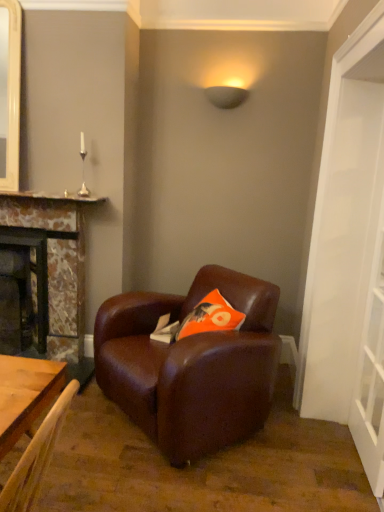
Image resolution: width=384 pixels, height=512 pixels. What do you see at coordinates (36, 269) in the screenshot?
I see `matte stone fireplace at left, which appears as the first fireplace when viewed from the left` at bounding box center [36, 269].

What do you see at coordinates (211, 317) in the screenshot? Image resolution: width=384 pixels, height=512 pixels. I see `orange fabric pillow at center` at bounding box center [211, 317].

Measure the distance between marble fireplace at left, which is the 1th fireplace from right to left, and camera.

The depth of marble fireplace at left, which is the 1th fireplace from right to left, is 9.12 feet.

Describe the element at coordinates (371, 381) in the screenshot. I see `transparent glass door at right` at that location.

You are a GUI agent. You are given a task and a screenshot of the screen. Output one action in this format:
    pyautogui.click(x=<x>, y=<y>)
    Task: Click on the matte black lampshade at upper center
    
    Given the screenshot: What is the action you would take?
    pyautogui.click(x=226, y=96)

In order to face matte black lampshade at upper center, should I rotate leftwards or rightwards?

To align with it, rotate right about 4.599°.

The width and height of the screenshot is (384, 512). I want to click on white glossy door at right, so click(341, 249).

Can we say white glossy door at right lies outside transparent glass door at right?

white glossy door at right lies outside transparent glass door at right's area.

In order to click on door in front of the transparent glass door at right in this screenshot , I will do (x=341, y=249).

What's the angular difference between white glossy door at right and transparent glass door at right's facing directions?

The angular difference between white glossy door at right and transparent glass door at right is 0.404 degrees.

Looking at this image, is brown leather armchair at center taller than white glossy door at right?

In fact, brown leather armchair at center may be shorter than white glossy door at right.

From a real-world perspective, which object stands above the other?

From a 3D spatial view, white glossy door at right is above.

Is brown leather armchair at center not near white glossy door at right?

They are positioned close to each other.

Looking at their sizes, would you say brown leather armchair at center is wider or thinner than white glossy door at right?

Considering their sizes, brown leather armchair at center looks broader than white glossy door at right.

Considering the relative sizes of matte stone fireplace at left, acting as the 2th fireplace starting from the right, and brown leather armchair at center in the image provided, is matte stone fireplace at left, acting as the 2th fireplace starting from the right, thinner than brown leather armchair at center?

Yes, matte stone fireplace at left, acting as the 2th fireplace starting from the right, is thinner than brown leather armchair at center.

How different are the orientations of matte stone fireplace at left, acting as the 2th fireplace starting from the right, and brown leather armchair at center in degrees?

The facing directions of matte stone fireplace at left, acting as the 2th fireplace starting from the right, and brown leather armchair at center are 44.9 degrees apart.

From a real-world perspective, who is located higher, matte stone fireplace at left, acting as the 2th fireplace starting from the right, or brown leather armchair at center?

In real-world perspective, matte stone fireplace at left, acting as the 2th fireplace starting from the right, is above.

Is matte stone fireplace at left, acting as the 2th fireplace starting from the right, facing away from brown leather armchair at center?

No, brown leather armchair at center is not at the back of matte stone fireplace at left, acting as the 2th fireplace starting from the right.

Considering the relative sizes of white glossy door at right and matte black lampshade at upper center in the image provided, is white glossy door at right taller than matte black lampshade at upper center?

Indeed, white glossy door at right has a greater height compared to matte black lampshade at upper center.

How distant is white glossy door at right from matte black lampshade at upper center?

white glossy door at right is 1.28 meters away from matte black lampshade at upper center.

Is white glossy door at right thinner than matte black lampshade at upper center?

No.

Is white glossy door at right in front of or behind matte black lampshade at upper center in the image?

Clearly, white glossy door at right is in front of matte black lampshade at upper center.

From a real-world perspective, who is located higher, white glossy door at right or brown leather armchair at center?

In real-world perspective, white glossy door at right is above.

Can you confirm if white glossy door at right is shorter than brown leather armchair at center?

A: Incorrect, the height of white glossy door at right does not fall short of that of brown leather armchair at center.

Is white glossy door at right placed right next to brown leather armchair at center?

No, white glossy door at right is not with brown leather armchair at center.

From the image's perspective, does white glossy door at right appear higher than brown leather armchair at center?

Indeed, from the image's perspective, white glossy door at right is shown above brown leather armchair at center.

Considering the relative sizes of matte stone fireplace at left, acting as the 2th fireplace starting from the right, and white glossy door at right in the image provided, is matte stone fireplace at left, acting as the 2th fireplace starting from the right, smaller than white glossy door at right?

Yes, matte stone fireplace at left, acting as the 2th fireplace starting from the right, is smaller than white glossy door at right.

Are matte stone fireplace at left, which appears as the first fireplace when viewed from the left, and white glossy door at right making contact?

No, matte stone fireplace at left, which appears as the first fireplace when viewed from the left, is not making contact with white glossy door at right.

Which object is wider, matte stone fireplace at left, acting as the 2th fireplace starting from the right, or white glossy door at right?

With larger width is white glossy door at right.

Considering the relative positions of matte stone fireplace at left, acting as the 2th fireplace starting from the right, and white glossy door at right in the image provided, is matte stone fireplace at left, acting as the 2th fireplace starting from the right, to the left of white glossy door at right from the viewer's perspective?

Indeed, matte stone fireplace at left, acting as the 2th fireplace starting from the right, is positioned on the left side of white glossy door at right.

Looking at this image, which of these two, marble fireplace at left, the 2th fireplace in the left-to-right sequence, or orange fabric pillow at center, is smaller?

Smaller between the two is orange fabric pillow at center.

From the image's perspective, is marble fireplace at left, the 2th fireplace in the left-to-right sequence, under orange fabric pillow at center?

No, from the image's perspective, marble fireplace at left, the 2th fireplace in the left-to-right sequence, is not below orange fabric pillow at center.

Choose the correct answer: Is marble fireplace at left, the 2th fireplace in the left-to-right sequence, inside orange fabric pillow at center or outside it?

marble fireplace at left, the 2th fireplace in the left-to-right sequence, cannot be found inside orange fabric pillow at center.

Find the location of a particular element. This screenshot has width=384, height=512. door that is above the transparent glass door at right (from the image's perspective) is located at coordinates (x=341, y=249).

You are a GUI agent. You are given a task and a screenshot of the screen. Output one action in this format:
    pyautogui.click(x=<x>, y=<y>)
    Task: Click on the door in front of the brown leather armchair at center
    This screenshot has height=512, width=384.
    Given the screenshot: What is the action you would take?
    pyautogui.click(x=341, y=249)

In the scene shown: Estimate the real-world distances between objects in this image. Which object is further from orange fabric pillow at center, matte black lampshade at upper center or white glossy door at right?

Based on the image, matte black lampshade at upper center appears to be further to orange fabric pillow at center.

Considering their positions, is transparent glass door at right positioned further to orange fabric pillow at center than brown leather armchair at center?

transparent glass door at right is positioned further to the anchor orange fabric pillow at center.

Considering their positions, is brown leather armchair at center positioned closer to orange fabric pillow at center than matte stone fireplace at left, which appears as the first fireplace when viewed from the left?

The object closer to orange fabric pillow at center is brown leather armchair at center.

From the image, which object appears to be nearer to marble fireplace at left, the 2th fireplace in the left-to-right sequence, brown leather armchair at center or orange fabric pillow at center?

brown leather armchair at center is positioned closer to the anchor marble fireplace at left, the 2th fireplace in the left-to-right sequence.

From the image, which object appears to be farther from matte stone fireplace at left, acting as the 2th fireplace starting from the right, brown leather armchair at center or orange fabric pillow at center?

orange fabric pillow at center lies further to matte stone fireplace at left, acting as the 2th fireplace starting from the right, than the other object.

Looking at the image, which one is located further to transparent glass door at right, matte stone fireplace at left, acting as the 2th fireplace starting from the right, or white glossy door at right?

matte stone fireplace at left, acting as the 2th fireplace starting from the right.

Based on their spatial positions, is brown leather armchair at center or white glossy door at right further from orange fabric pillow at center?

The object further to orange fabric pillow at center is white glossy door at right.

Looking at the image, which one is located further to white glossy door at right, brown leather armchair at center or matte black lampshade at upper center?

matte black lampshade at upper center is positioned further to the anchor white glossy door at right.

The height and width of the screenshot is (512, 384). I want to click on lamp situated between matte stone fireplace at left, acting as the 2th fireplace starting from the right, and transparent glass door at right from left to right, so click(x=226, y=96).

You are a GUI agent. You are given a task and a screenshot of the screen. Output one action in this format:
    pyautogui.click(x=<x>, y=<y>)
    Task: Click on the fireplace between matte stone fireplace at left, acting as the 2th fireplace starting from the right, and transparent glass door at right
    This screenshot has width=384, height=512.
    Given the screenshot: What is the action you would take?
    pyautogui.click(x=52, y=272)

Where is `chair between white glossy door at right and matte black lampshade at upper center along the z-axis`? chair between white glossy door at right and matte black lampshade at upper center along the z-axis is located at coordinates (191, 365).

Identify the location of pillow between matte stone fireplace at left, which appears as the first fireplace when viewed from the left, and white glossy door at right from left to right. (211, 317).